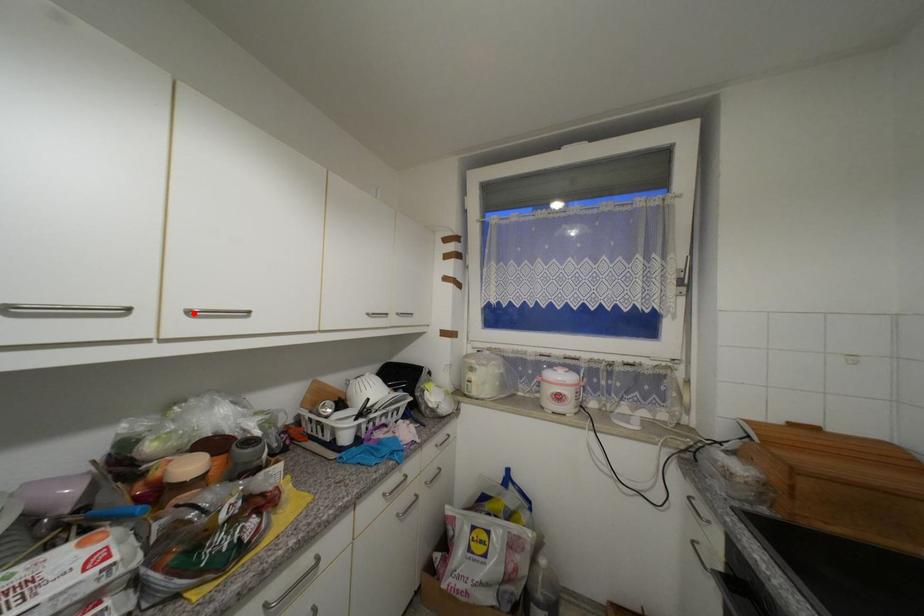
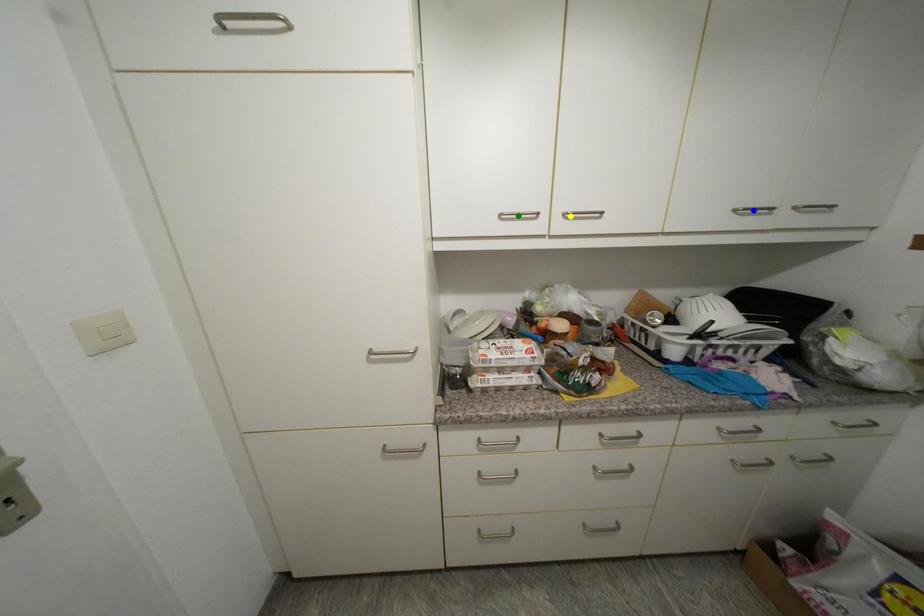
Question: I am providing you with two images of the same scene from different viewpoints. A red point is marked on the first image. You are given multiple points on the second image. Which spot in image 2 lines up with the point in image 1?

Choices:
 (A) blue point
 (B) green point
 (C) yellow point

Answer: (C)